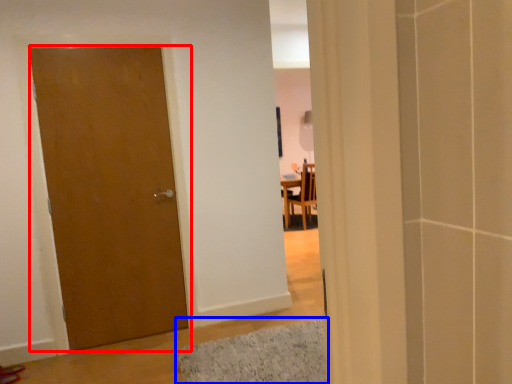
Question: Among these objects, which one is farthest to the camera, door (highlighted by a red box) or bath mat (highlighted by a blue box)?

Choices:
 (A) door
 (B) bath mat

Answer: (A)